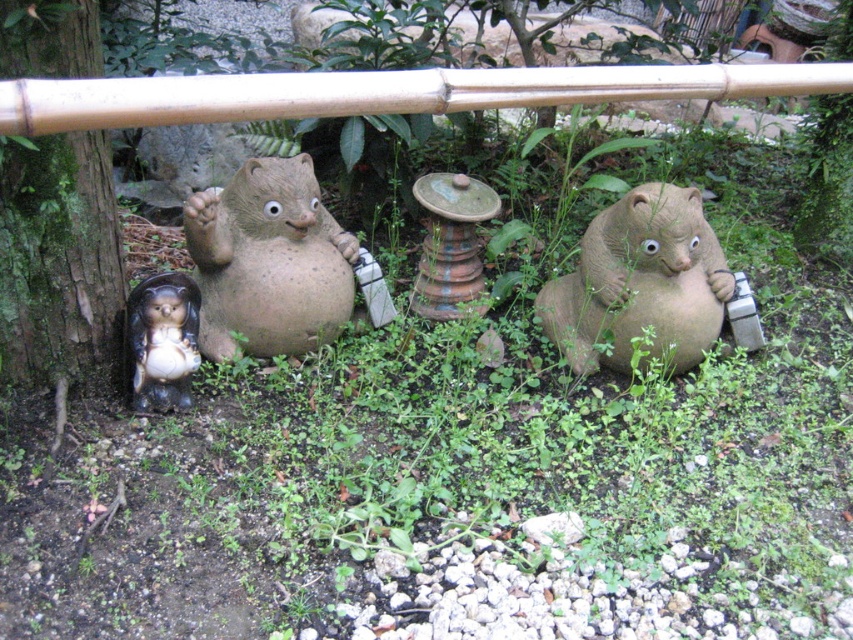
Question: Which of the following is the closest to the observer?

Choices:
 (A) glossy ceramic hedgehog at lower left
 (B) matte clay bear at center
 (C) green mossy bark at left

Answer: (C)

Question: Does green mossy bark at left have a smaller size compared to matte ceramic bear at center?

Choices:
 (A) no
 (B) yes

Answer: (A)

Question: Which point is closer to the camera?

Choices:
 (A) matte clay bear at center
 (B) glossy ceramic hedgehog at lower left
 (C) green mossy bark at left

Answer: (C)

Question: Is matte ceramic bear at center closer to the viewer compared to glossy ceramic hedgehog at lower left?

Choices:
 (A) no
 (B) yes

Answer: (A)

Question: Based on their relative distances, which object is farther from the glossy ceramic hedgehog at lower left?

Choices:
 (A) matte ceramic bear at center
 (B) matte clay bear at center

Answer: (A)

Question: Is green mossy bark at left bigger than glossy ceramic hedgehog at lower left?

Choices:
 (A) yes
 (B) no

Answer: (A)